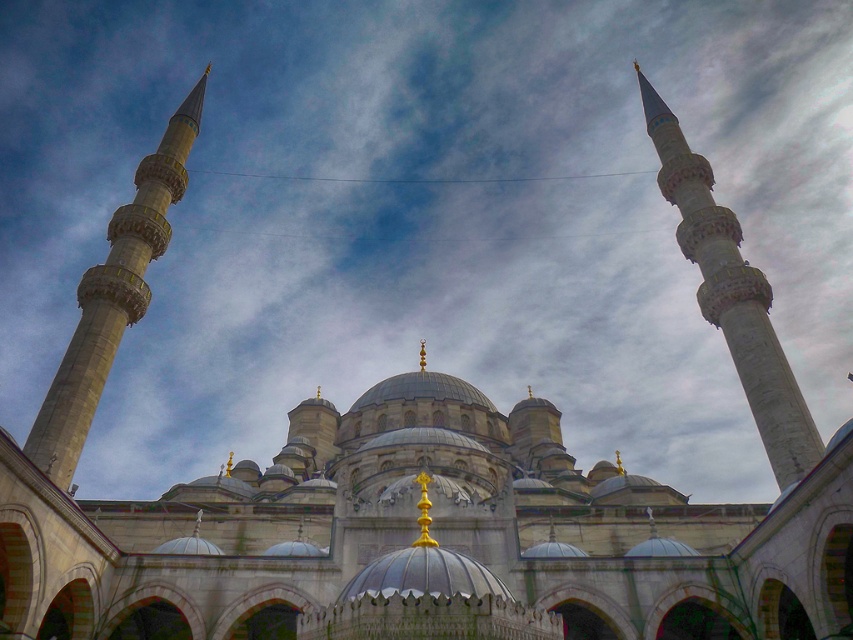
You are standing in front of the grand mosque and want to take a photo of the white marble minaret at upper right. Considering the distance between you and the minaret is 81.60 meters, will you need a telephoto lens to capture it clearly?

Yes, you will need a telephoto lens to capture the white marble minaret at upper right clearly since it is 81.60 meters away from the viewer.

You are an architect analyzing the symmetry of the mosque. Given that you observe the white marble minaret at upper right and the gray stone minaret at left, which minaret has a greater width?

The white marble minaret at upper right has a greater width than the gray stone minaret at left according to the description.

You are standing in front of the grand mosque and want to take a photo. You notice two points marked on the mosque structure at coordinates point (x=693, y=168) and point (x=102, y=296). Which point is closer to your camera lens when taking the photo?

Point (x=102, y=296) is closer to the camera lens because the Objects Description states that point (x=693, y=168) is further away than point (x=102, y=296).